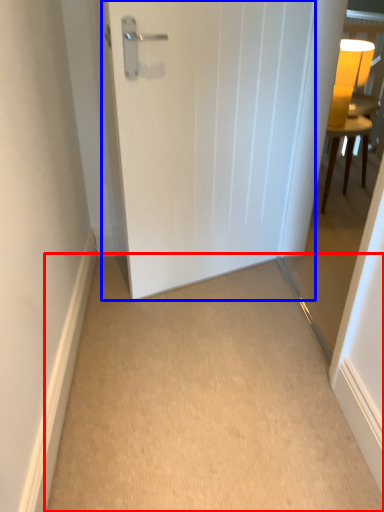
Question: Among these objects, which one is nearest to the camera, corridor (highlighted by a red box) or door (highlighted by a blue box)?

Choices:
 (A) corridor
 (B) door

Answer: (A)